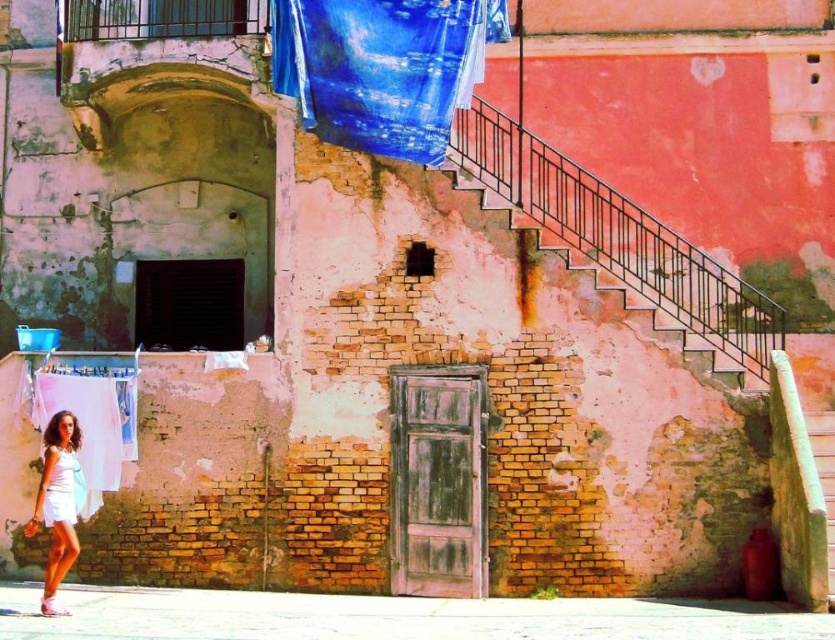
You are an artist observing the scene and want to paint the white fabric at lower left and the white matte skirt at lower left. Which object is covering the other?

The white fabric at lower left is positioned over the white matte skirt at lower left, so the white fabric is covering the skirt.

You are standing at a point 56.83 meters away from the point marked at coordinates point (706, 323). If you want to move closer to that point, which direction should you walk?

Since you are 56.83 meters away from the point marked at coordinates point (706, 323), you should walk towards that point to get closer.

You are standing at the entrance of the building and need to reach the second floor. The rusty metal stairs at center are your only option. Can you confirm their location relative to the wooden door?

The rusty metal stairs at center are located to the right of the wooden door, as indicated by their position at point coordinates.